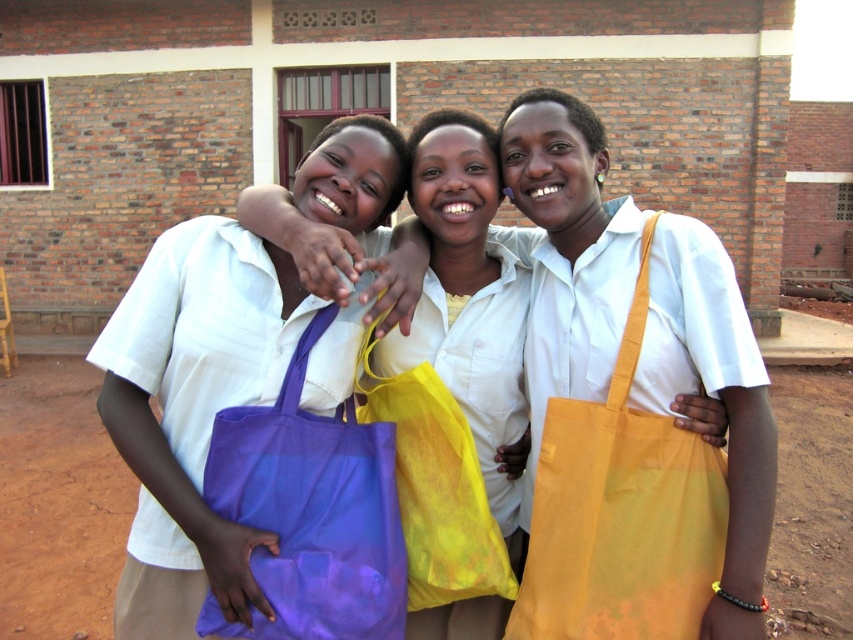
Between point (634, 620) and point (408, 557), which one is positioned in front?

Positioned in front is point (634, 620).

Does yellow fabric tote at right appear on the right side of purple fabric bag at center?

Correct, you'll find yellow fabric tote at right to the right of purple fabric bag at center.

Is point (689, 588) less distant than point (453, 477)?

Yes.

Identify the location of yellow fabric tote at right. (621, 513).

Is matte purple tote bag at left smaller than purple fabric bag at center?

Actually, matte purple tote bag at left might be larger than purple fabric bag at center.

Find the location of `matte purple tote bag at left`. matte purple tote bag at left is located at coordinates (192, 412).

Does point (236, 355) come in front of point (421, 589)?

Yes.

You are a GUI agent. You are given a task and a screenshot of the screen. Output one action in this format:
    pyautogui.click(x=<x>, y=<y>)
    Task: Click on the matte purple tote bag at left
    
    Given the screenshot: What is the action you would take?
    pyautogui.click(x=192, y=412)

Does matte yellow tote bag at center have a lesser width compared to purple fabric bag at center?

No.

From the picture: Is matte yellow tote bag at center taller than purple fabric bag at center?

Indeed, matte yellow tote bag at center has a greater height compared to purple fabric bag at center.

Between point (751, 560) and point (416, 563), which one is positioned behind?

The point (416, 563) is more distant.

This screenshot has width=853, height=640. I want to click on matte yellow tote bag at center, so click(631, 384).